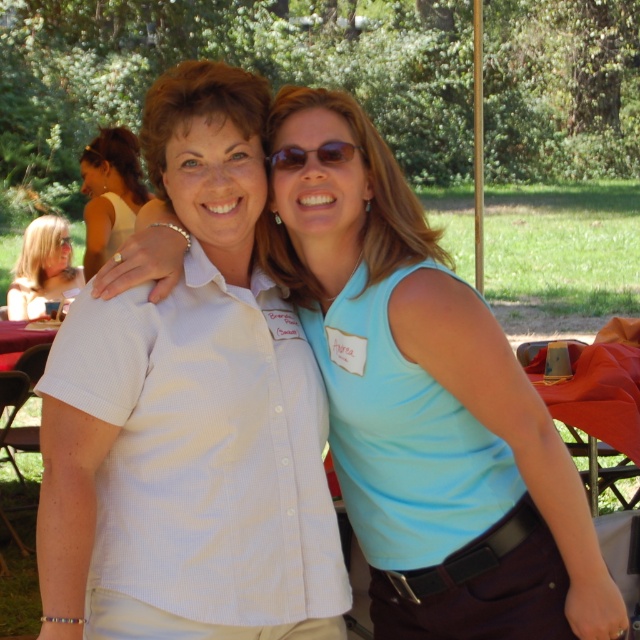
Who is taller, white woven shirt at center or matte gold necklace at upper left?

With more height is white woven shirt at center.

Does white woven shirt at center have a lesser height compared to matte gold necklace at upper left?

Incorrect, white woven shirt at center's height does not fall short of matte gold necklace at upper left's.

Who is more distant from viewer, (500, 589) or (120, 176)?

Positioned behind is point (120, 176).

Where is `white woven shirt at center`? The width and height of the screenshot is (640, 640). white woven shirt at center is located at coordinates (426, 403).

Is point (38, 218) positioned in front of point (346, 160)?

That is False.

Which is above, blonde hair at upper left or sunglasses at center?

sunglasses at center is above.

Find the location of a particular element. blonde hair at upper left is located at coordinates (42, 268).

The height and width of the screenshot is (640, 640). What are the coordinates of `blonde hair at upper left` in the screenshot? It's located at (42, 268).

Is matte gold necklace at upper left positioned at the back of blonde hair at upper left?

No, matte gold necklace at upper left is closer to the viewer.

Between matte gold necklace at upper left and blonde hair at upper left, which one is positioned lower?

blonde hair at upper left

Locate an element on the screen. The image size is (640, 640). matte gold necklace at upper left is located at coordinates (109, 193).

In order to click on matte gold necklace at upper left in this screenshot , I will do `click(109, 193)`.